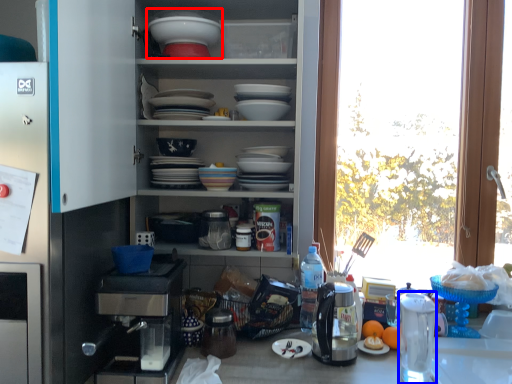
Question: Which of the following is the closest to the observer, appliance (highlighted by a red box) or appliance (highlighted by a blue box)?

Choices:
 (A) appliance
 (B) appliance

Answer: (B)